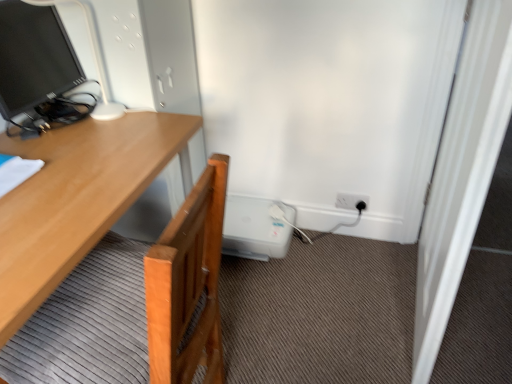
Question: From their relative heights in the image, would you say light wood desk at left is taller or shorter than white wooden screen door at right?

Choices:
 (A) short
 (B) tall

Answer: (A)

Question: From the image's perspective, is light wood desk at left located above or below white wooden screen door at right?

Choices:
 (A) above
 (B) below

Answer: (B)

Question: Estimate the real-world distances between objects in this image. Which object is closer to the white wooden screen door at right?

Choices:
 (A) light wood desk at left
 (B) black plastic power outlet at lower right
 (C) matte black monitor at upper left

Answer: (B)

Question: Which is nearer to the white wooden screen door at right?

Choices:
 (A) black plastic power outlet at lower right
 (B) light wood desk at left
 (C) matte black monitor at upper left

Answer: (A)